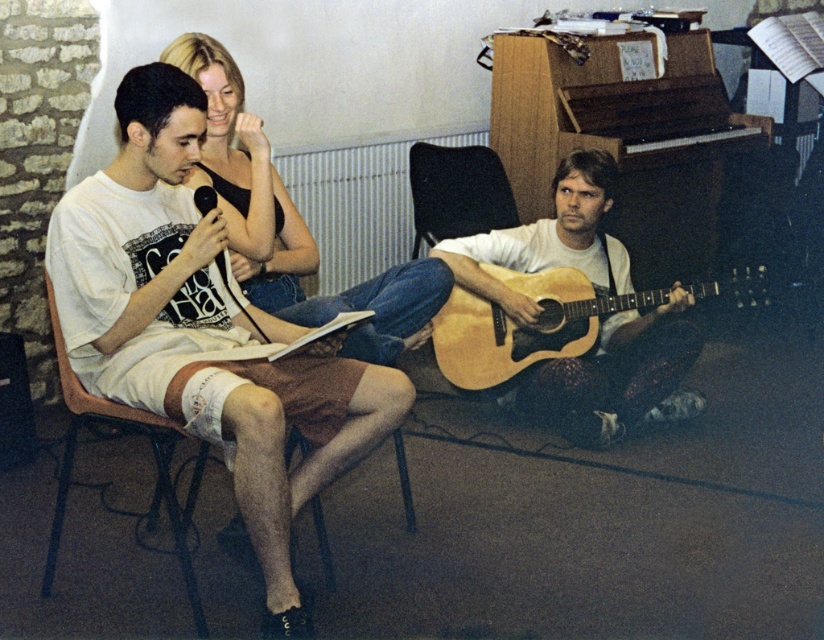
You are standing at the origin point in the image. Which of the two points, point (x=637, y=346) or point (x=212, y=54), is farther away from you?

Point (x=637, y=346) is farther away from you because it is behind point (x=212, y=54).

You are a photographer setting up a shoot in the scene. You need to decide which object, the white cotton shorts at center or the wooden acoustic guitar at lower right, requires more space in the frame to capture its full detail. Which object should you prioritize?

The white cotton shorts at center is bigger than the wooden acoustic guitar at lower right, so you should prioritize capturing the white cotton shorts at center to ensure its full detail is visible.

You are a photographer setting up for a photoshoot in the room. You need to position a light source to the right of the matte black tank top at upper left. Will the light source interfere with the wooden acoustic guitar at lower right?

The wooden acoustic guitar at lower right is to the right of the matte black tank top at upper left, so placing the light source to the right of the matte black tank top at upper left would position it near the wooden acoustic guitar at lower right. This might interfere with the guitar unless adjusted for space.